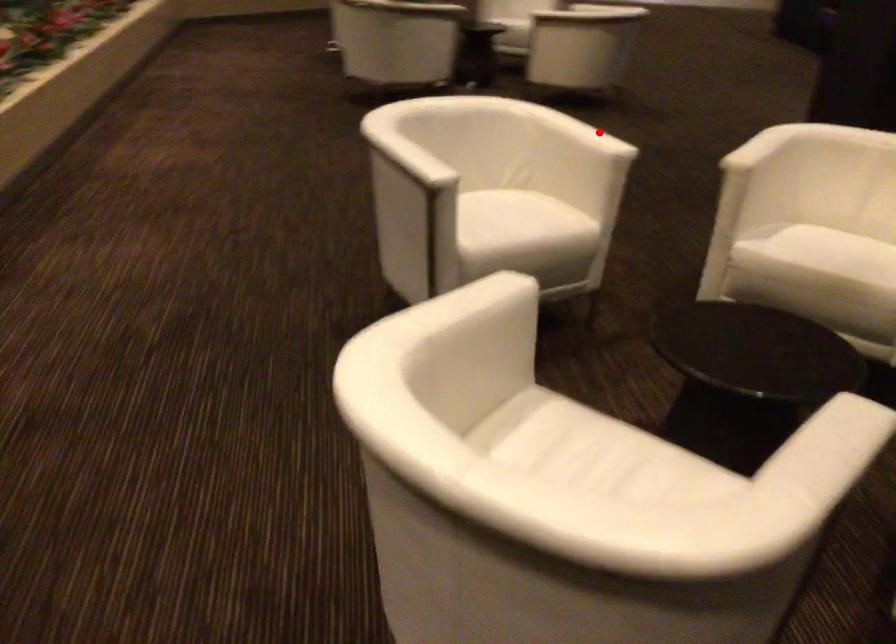
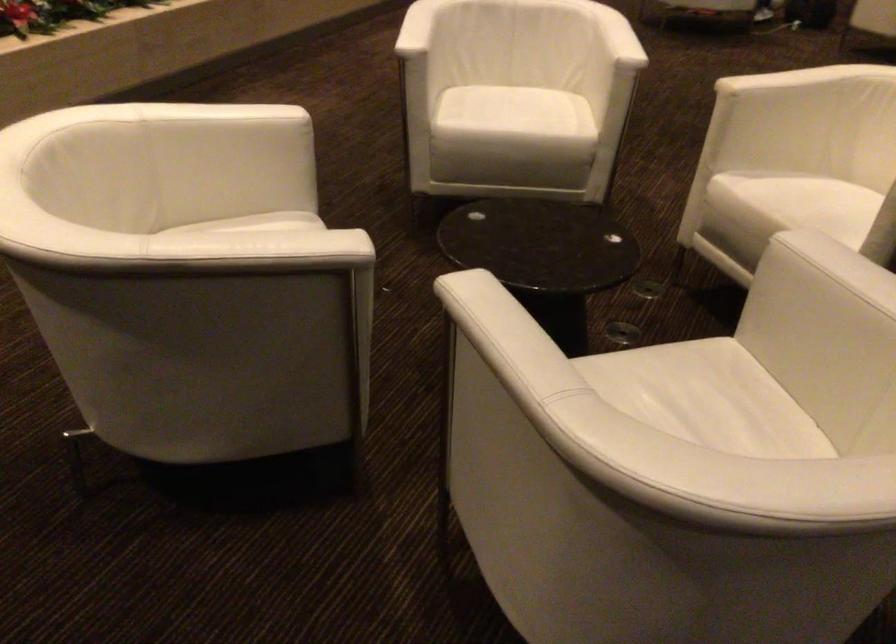
Find the pixel in the second image that matches the highlighted location in the first image.

(617, 37)